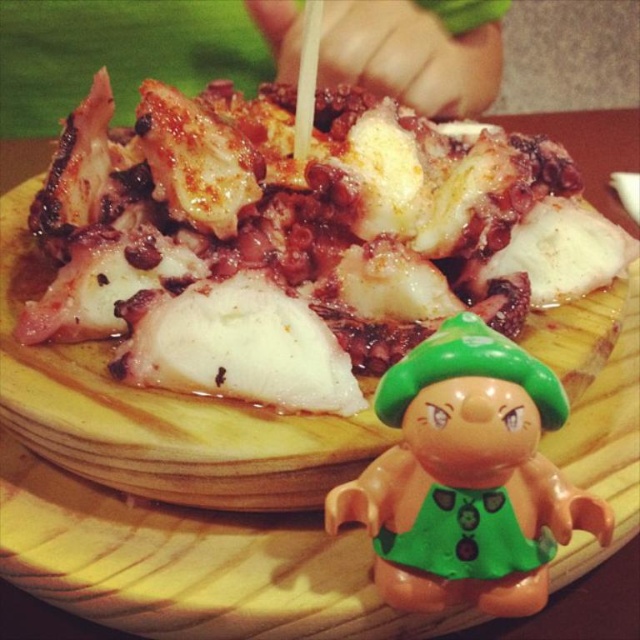
Looking at the wooden platter with the slightly charred octopus at center and the green plastic toy at lower right, which object is positioned to the right side?

The green plastic toy at lower right is positioned to the right of the slightly charred octopus at center.

You are a food critic standing at the edge of the wooden platter. You need to reach the slightly charred octopus at center to taste it. If your hand can only move in a straight line from your current position, which direction should you move your hand to reach it?

The slightly charred octopus at center is located at coordinates point (298,240), so you should move your hand towards the center of the platter to reach it.

You are standing in front of a plate of grilled octopus on a wooden platter. There are two points marked on the plate at coordinates point [301,259] and point [435,556]. If you want to place a small green figurine closer to you on the plate, which point should you choose?

You should choose point [301,259] because it is closer to you than point [435,556].